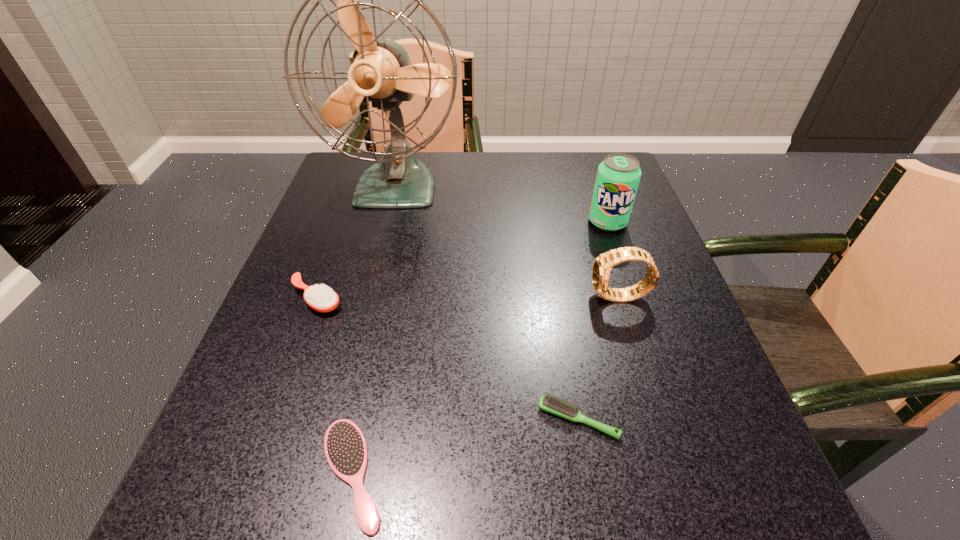
Locate an element on the screen. The width and height of the screenshot is (960, 540). the second closest hairbrush to the fan is located at coordinates pos(547,403).

Identify which hairbrush is the closest to the rightmost hairbrush. Please provide its 2D coordinates. Your answer should be formatted as a tuple, i.e. [(x, y)], where the tuple contains the x and y coordinates of a point satisfying the conditions above.

[(345, 447)]

Identify the location of vacant space that satisfies the following two spatial constraints: 1. on the front-facing side of the tallest object for air flow; 2. on the right side of the second hairbrush from right to left. (327, 473).

Where is `free point that satisfies the following two spatial constraints: 1. on the front-facing side of the fan for air flow; 2. on the left side of the third object from right to left`? The image size is (960, 540). free point that satisfies the following two spatial constraints: 1. on the front-facing side of the fan for air flow; 2. on the left side of the third object from right to left is located at coordinates (340, 419).

Identify the location of free space that satisfies the following two spatial constraints: 1. on the front-facing side of the pop soda; 2. on the face of the watch. The width and height of the screenshot is (960, 540). (634, 298).